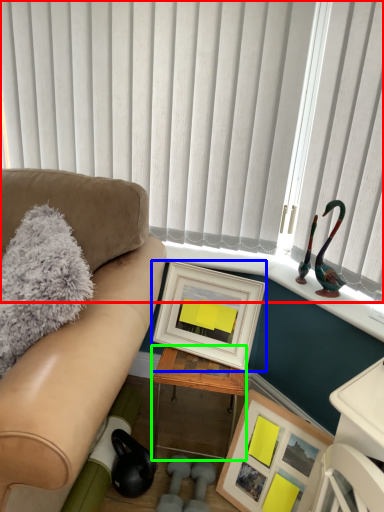
Question: Based on their relative distances, which object is nearer to window blind (highlighted by a red box)? Choose from picture frame (highlighted by a blue box) and table (highlighted by a green box).

Choices:
 (A) picture frame
 (B) table

Answer: (A)